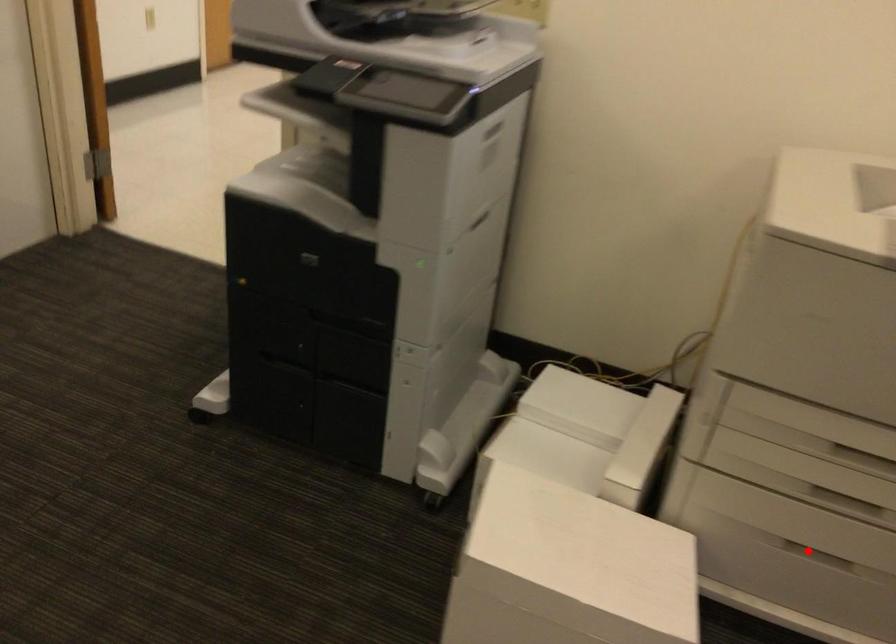
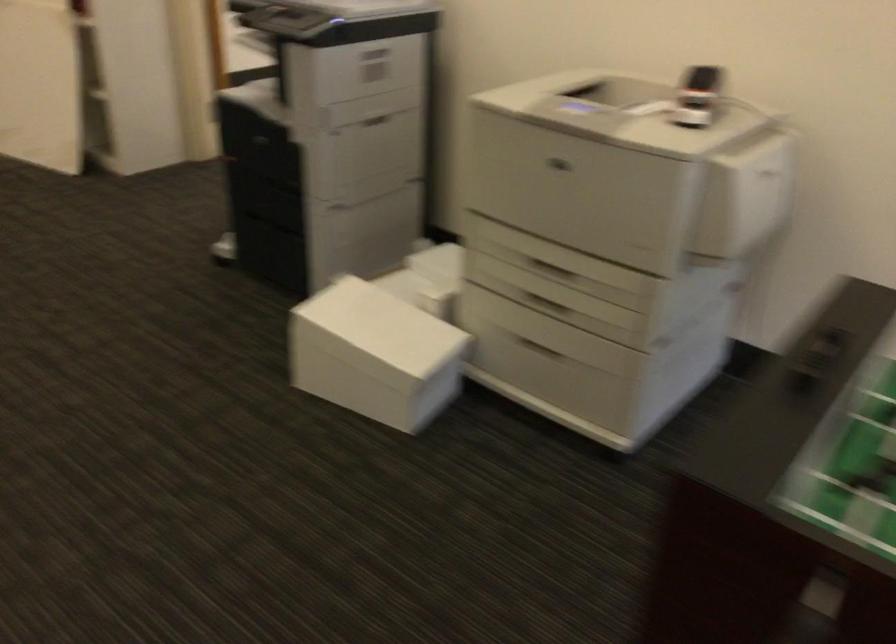
The point at the highlighted location is marked in the first image. Where is the corresponding point in the second image?

(537, 346)